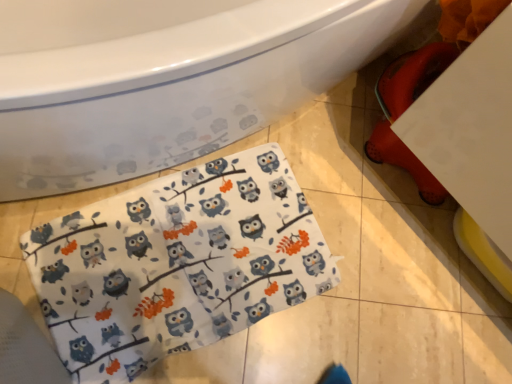
Find the location of a particular element. empty space that is ontop of white fabric with owl print at lower center is located at coordinates (187, 262).